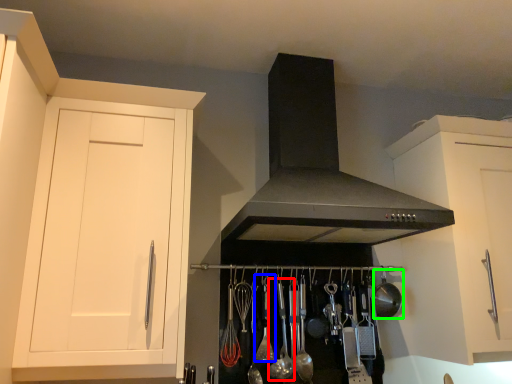
Question: Which object is the closest to the utensil (highlighted by a red box)? Choose among these: utensil (highlighted by a blue box) or appliance (highlighted by a green box).

Choices:
 (A) utensil
 (B) appliance

Answer: (A)